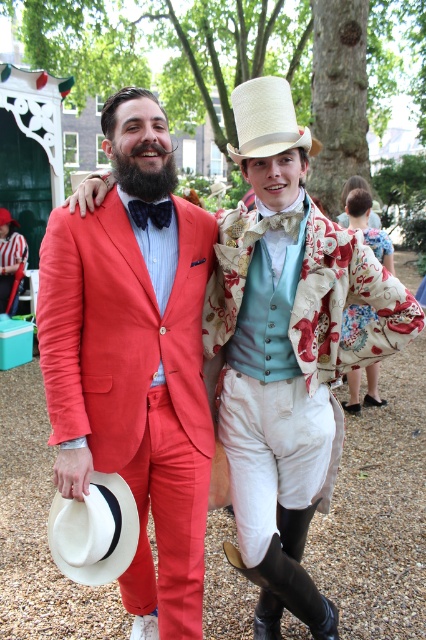
Question: Is white straw cowboy hat at upper center above velvet bow tie at center?

Choices:
 (A) yes
 (B) no

Answer: (A)

Question: Is matte red suit at left wider than white straw cowboy hat at upper center?

Choices:
 (A) no
 (B) yes

Answer: (B)

Question: Does matte red suit at left have a larger size compared to white straw cowboy hat at upper center?

Choices:
 (A) no
 (B) yes

Answer: (B)

Question: Among these points, which one is nearest to the camera?

Choices:
 (A) (249, 244)
 (B) (245, 138)

Answer: (B)

Question: Among these points, which one is farthest from the camera?

Choices:
 (A) [x=294, y=209]
 (B) [x=184, y=276]
 (C) [x=109, y=515]

Answer: (A)

Question: Which point is closer to the camera?

Choices:
 (A) (160, 220)
 (B) (195, 552)
 (C) (100, 484)
 (D) (279, 77)

Answer: (C)